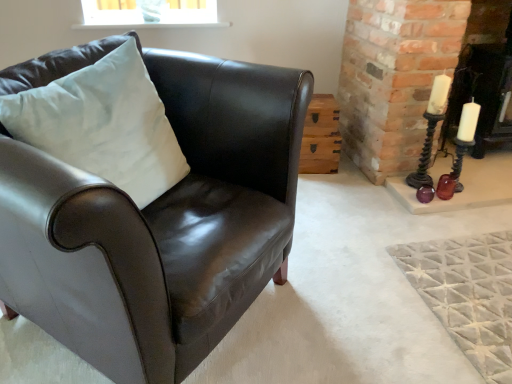
Question: Would you say wooden crate at center-right is to the left or to the right of metallic dark brown candle holder at right in the picture?

Choices:
 (A) left
 (B) right

Answer: (A)

Question: From a real-world perspective, is wooden crate at center-right above or below metallic dark brown candle holder at right?

Choices:
 (A) below
 (B) above

Answer: (A)

Question: Considering the real-world distances, which object is farthest from the white glossy fireplace at right?

Choices:
 (A) metallic dark brown candle holder at right
 (B) wooden crate at center-right
 (C) white satin pillow at left
 (D) shiny brown leather armchair at left

Answer: (C)

Question: Which of these objects is positioned farthest from the shiny brown leather armchair at left?

Choices:
 (A) white satin pillow at left
 (B) white glossy fireplace at right
 (C) wooden crate at center-right
 (D) metallic dark brown candle holder at right

Answer: (B)